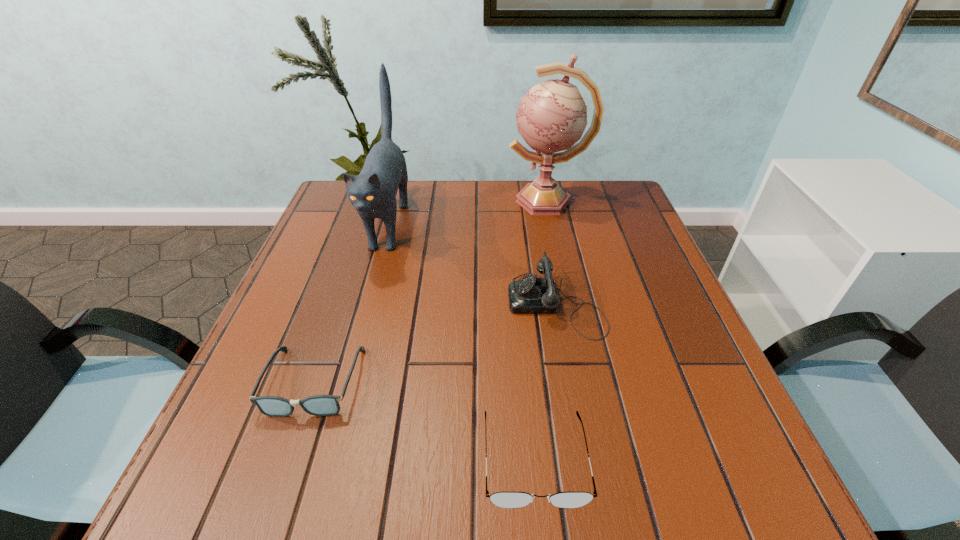
At what (x,y) coordinates should I click in order to perform the action: click on globe. Please return your answer as a coordinate pair (x, y). Looking at the image, I should click on (552, 116).

I want to click on cat, so [373, 192].

At what (x,y) coordinates should I click in order to perform the action: click on telephone. Please return your answer as a coordinate pair (x, y). The height and width of the screenshot is (540, 960). Looking at the image, I should click on (531, 294).

Identify the location of the left spectacles. (319, 405).

The height and width of the screenshot is (540, 960). Find the location of `the right spectacles`. the right spectacles is located at coordinates (510, 500).

The image size is (960, 540). I want to click on vacant space located 0.250m on the front-facing side of the globe, so click(421, 201).

Locate an element on the screen. vacant space positioned on the front-facing side of the globe is located at coordinates (387, 201).

You are a GUI agent. You are given a task and a screenshot of the screen. Output one action in this format:
    pyautogui.click(x=<x>, y=<y>)
    Task: Click on the free space located on the front-facing side of the globe
    Image resolution: width=960 pixels, height=540 pixels.
    Given the screenshot: What is the action you would take?
    pyautogui.click(x=376, y=201)

Identify the location of vacant space located 0.110m at the face of the cat. (365, 308).

Find the location of `free space located on the front-facing side of the third tallest object`. free space located on the front-facing side of the third tallest object is located at coordinates (413, 302).